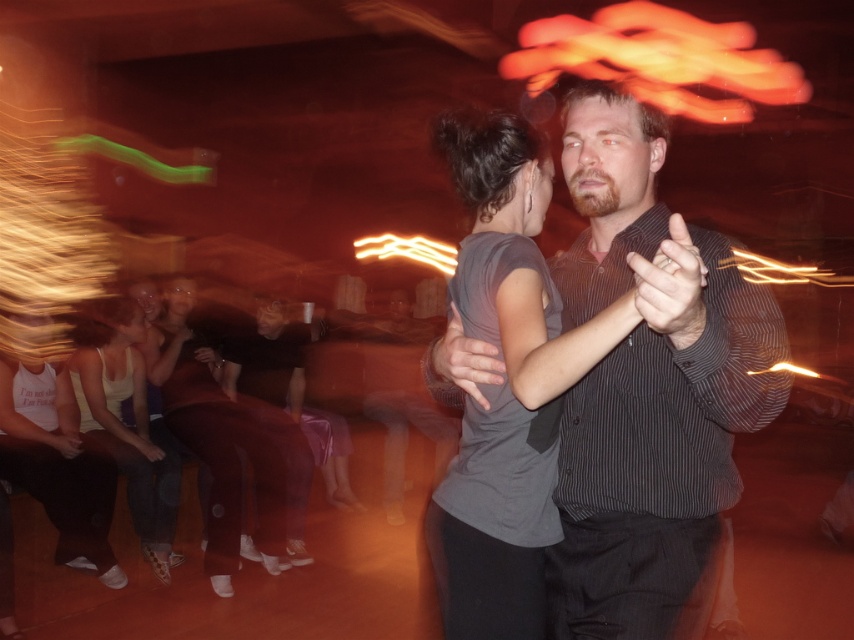
Question: Can you confirm if striped button-up shirt at center is positioned below dark gray striped shirt at center?

Choices:
 (A) no
 (B) yes

Answer: (A)

Question: Does denim jeans at lower left appear over dark brown leather jacket at lower left?

Choices:
 (A) yes
 (B) no

Answer: (B)

Question: Is denim jeans at lower left smaller than dark gray striped shirt at center?

Choices:
 (A) yes
 (B) no

Answer: (A)

Question: Which object appears farthest from the camera in this image?

Choices:
 (A) dark brown leather jacket at lower left
 (B) denim jeans at lower left

Answer: (A)

Question: Which object appears farthest from the camera in this image?

Choices:
 (A) dark brown leather jacket at lower left
 (B) striped button-up shirt at center
 (C) dark gray striped shirt at center

Answer: (C)

Question: Which point is closer to the camera?

Choices:
 (A) (272, 424)
 (B) (156, 458)

Answer: (B)